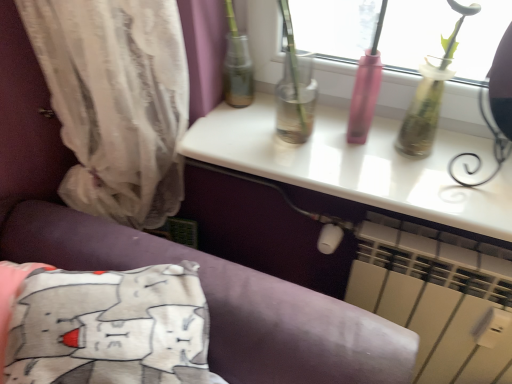
Measure the distance between translucent fabric curtain at left and camera.

A distance of 28.65 inches exists between translucent fabric curtain at left and camera.

The width and height of the screenshot is (512, 384). Describe the element at coordinates (116, 102) in the screenshot. I see `translucent fabric curtain at left` at that location.

Identify the location of white glossy table at upper center. The image size is (512, 384). (358, 165).

Locate an element on the screen. The width and height of the screenshot is (512, 384). translucent fabric curtain at left is located at coordinates (116, 102).

Is white plastic radiator at lower right facing towards white glossy table at upper center?

No, white plastic radiator at lower right does not turn towards white glossy table at upper center.

In terms of height, does white plastic radiator at lower right look taller or shorter compared to white glossy table at upper center?

Clearly, white plastic radiator at lower right is taller compared to white glossy table at upper center.

Is white plastic radiator at lower right to the left of white glossy table at upper center from the viewer's perspective?

Incorrect, white plastic radiator at lower right is not on the left side of white glossy table at upper center.

Considering their positions, is translucent fabric curtain at left located in front of or behind white glossy table at upper center?

Visually, translucent fabric curtain at left is located in front of white glossy table at upper center.

Considering the sizes of objects translucent fabric curtain at left and white glossy table at upper center in the image provided, who is smaller, translucent fabric curtain at left or white glossy table at upper center?

With smaller size is white glossy table at upper center.

From the image's perspective, is translucent fabric curtain at left positioned above or below white glossy table at upper center?

translucent fabric curtain at left is above white glossy table at upper center.

Does translucent fabric curtain at left have a lesser height compared to white glossy table at upper center?

No.

From the image's perspective, which is below, white cotton pillow at lower left or white glossy table at upper center?

white cotton pillow at lower left, from the image's perspective.

How different are the orientations of white cotton pillow at lower left and white glossy table at upper center in degrees?

24.9 degrees.

Consider the image. Could you tell me if white cotton pillow at lower left is turned towards white glossy table at upper center?

No, white cotton pillow at lower left is not turned towards white glossy table at upper center.

Which object is wider, white cotton pillow at lower left or white glossy table at upper center?

white cotton pillow at lower left is wider.

Which point is more forward, (x=439, y=172) or (x=54, y=24)?

The point (x=54, y=24) is closer.

Which of these two, white glossy table at upper center or translucent fabric curtain at left, stands shorter?

With less height is white glossy table at upper center.

In terms of width, does white glossy table at upper center look wider or thinner when compared to translucent fabric curtain at left?

Considering their sizes, white glossy table at upper center looks broader than translucent fabric curtain at left.

In the scene shown: Is white glossy table at upper center in front of or behind translucent fabric curtain at left in the image?

In the image, white glossy table at upper center appears behind translucent fabric curtain at left.

Which of these two, translucent fabric curtain at left or white cotton pillow at lower left, is wider?

With larger width is white cotton pillow at lower left.

From the picture: Are translucent fabric curtain at left and white cotton pillow at lower left located far from each other?

Actually, translucent fabric curtain at left and white cotton pillow at lower left are a little close together.

From the image's perspective, which one is positioned higher, translucent fabric curtain at left or white cotton pillow at lower left?

translucent fabric curtain at left.

Which of these two, translucent fabric curtain at left or white cotton pillow at lower left, stands shorter?

white cotton pillow at lower left.

Who is shorter, white plastic radiator at lower right or white cotton pillow at lower left?

Standing shorter between the two is white cotton pillow at lower left.

Consider the image. Is white plastic radiator at lower right to the left or to the right of white cotton pillow at lower left in the image?

white plastic radiator at lower right is positioned on white cotton pillow at lower left's right side.

What are the coordinates of `furniture above the white plastic radiator at lower right (from a real-world perspective)` in the screenshot? It's located at (228, 303).

Is white plastic radiator at lower right closer to camera compared to white cotton pillow at lower left?

No, white plastic radiator at lower right is behind white cotton pillow at lower left.

Is white cotton pillow at lower left thinner than white plastic radiator at lower right?

No, white cotton pillow at lower left is not thinner than white plastic radiator at lower right.

Based on the photo, would you say white cotton pillow at lower left is a long distance from white plastic radiator at lower right?

No, white cotton pillow at lower left is in close proximity to white plastic radiator at lower right.

From the image's perspective, is white cotton pillow at lower left above or below white plastic radiator at lower right?

white cotton pillow at lower left is above white plastic radiator at lower right.

Based on their sizes in the image, would you say white cotton pillow at lower left is bigger or smaller than white plastic radiator at lower right?

white cotton pillow at lower left is bigger than white plastic radiator at lower right.

What are the coordinates of `air conditioning below the white glossy table at upper center (from a real-world perspective)` in the screenshot? It's located at (434, 297).

The image size is (512, 384). I want to click on table behind the translucent fabric curtain at left, so click(358, 165).

Looking at the image, which one is located closer to white glossy table at upper center, translucent fabric curtain at left or white plastic radiator at lower right?

Based on the image, white plastic radiator at lower right appears to be nearer to white glossy table at upper center.

Which object lies nearer to the anchor point white plastic radiator at lower right, translucent fabric curtain at left or white cotton pillow at lower left?

white cotton pillow at lower left is closer to white plastic radiator at lower right.

Estimate the real-world distances between objects in this image. Which object is closer to translucent fabric curtain at left, white cotton pillow at lower left or white plastic radiator at lower right?

white cotton pillow at lower left.

When comparing their distances from white cotton pillow at lower left, does white glossy table at upper center or translucent fabric curtain at left seem further?

The object further to white cotton pillow at lower left is white glossy table at upper center.

Which object lies nearer to the anchor point translucent fabric curtain at left, white plastic radiator at lower right or white cotton pillow at lower left?

white cotton pillow at lower left.

When comparing their distances from white plastic radiator at lower right, does translucent fabric curtain at left or white glossy table at upper center seem closer?

white glossy table at upper center is positioned closer to the anchor white plastic radiator at lower right.

Looking at the image, which one is located closer to white glossy table at upper center, white plastic radiator at lower right or translucent fabric curtain at left?

Based on the image, white plastic radiator at lower right appears to be nearer to white glossy table at upper center.

Considering their positions, is white glossy table at upper center positioned closer to white cotton pillow at lower left than white plastic radiator at lower right?

Among the two, white glossy table at upper center is located nearer to white cotton pillow at lower left.

Where is `table situated between translucent fabric curtain at left and white plastic radiator at lower right from left to right`? table situated between translucent fabric curtain at left and white plastic radiator at lower right from left to right is located at coordinates (358, 165).

The height and width of the screenshot is (384, 512). Identify the location of furniture between translucent fabric curtain at left and white glossy table at upper center in the horizontal direction. (228, 303).

At what (x,y) coordinates should I click in order to perform the action: click on furniture between translucent fabric curtain at left and white plastic radiator at lower right. Please return your answer as a coordinate pair (x, y). This screenshot has width=512, height=384. Looking at the image, I should click on pyautogui.click(x=228, y=303).

The width and height of the screenshot is (512, 384). Find the location of `table between white cotton pillow at lower left and white plastic radiator at lower right from left to right`. table between white cotton pillow at lower left and white plastic radiator at lower right from left to right is located at coordinates (358, 165).